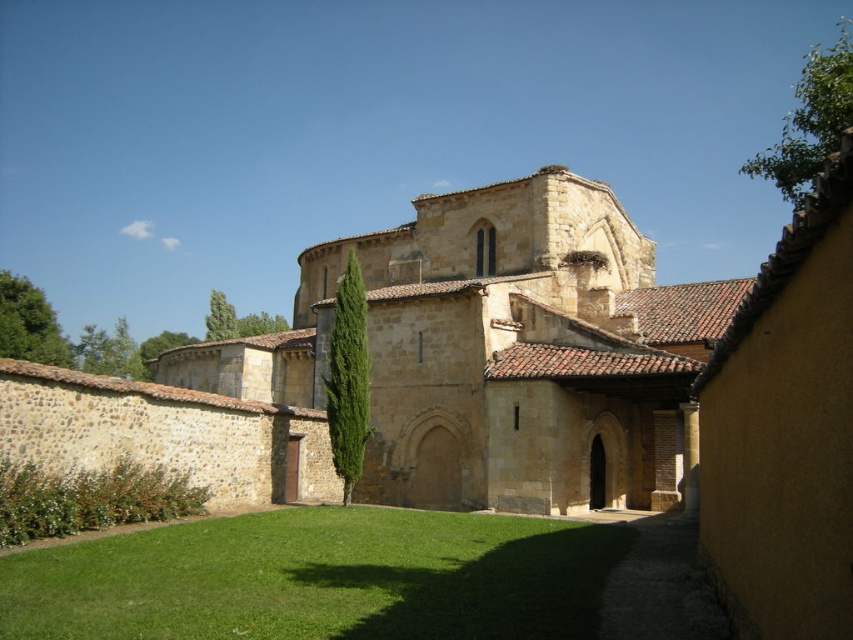
Question: Is beige stone chapel at center positioned in front of green grass at center?

Choices:
 (A) yes
 (B) no

Answer: (B)

Question: Does beige stone chapel at center come in front of green grass at center?

Choices:
 (A) no
 (B) yes

Answer: (A)

Question: Which point appears closest to the camera in this image?

Choices:
 (A) (229, 372)
 (B) (44, 598)

Answer: (B)

Question: Does beige stone chapel at center appear under green grass at center?

Choices:
 (A) yes
 (B) no

Answer: (B)